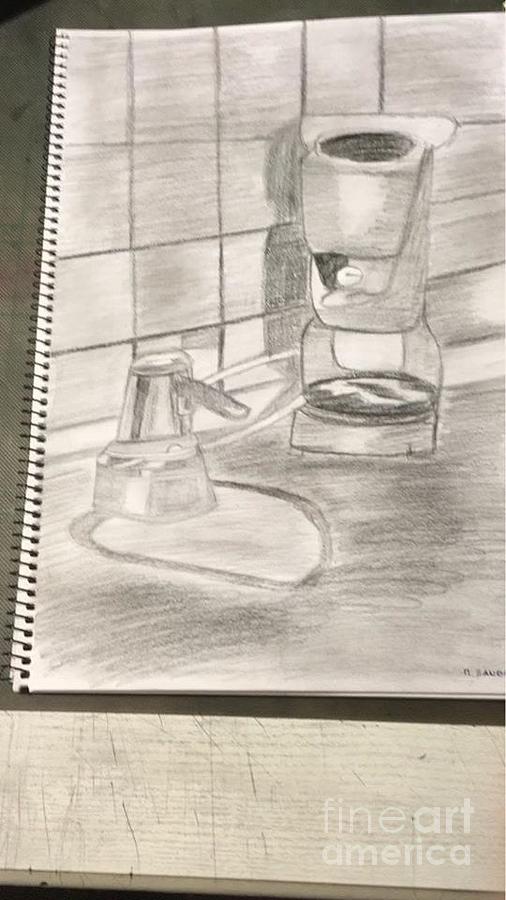
Where is `cord`? cord is located at coordinates (261, 425), (226, 369).